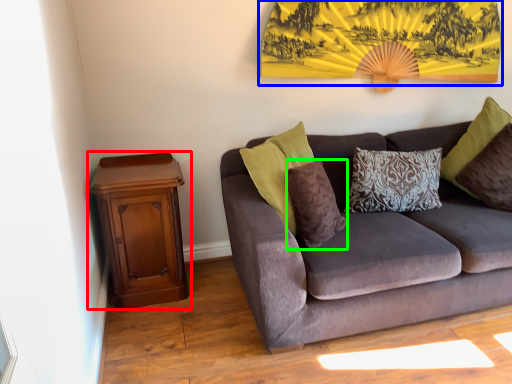
Question: Which is farther away from nightstand (highlighted by a red box)? mountain view (highlighted by a blue box) or pillow (highlighted by a green box)?

Choices:
 (A) mountain view
 (B) pillow

Answer: (A)